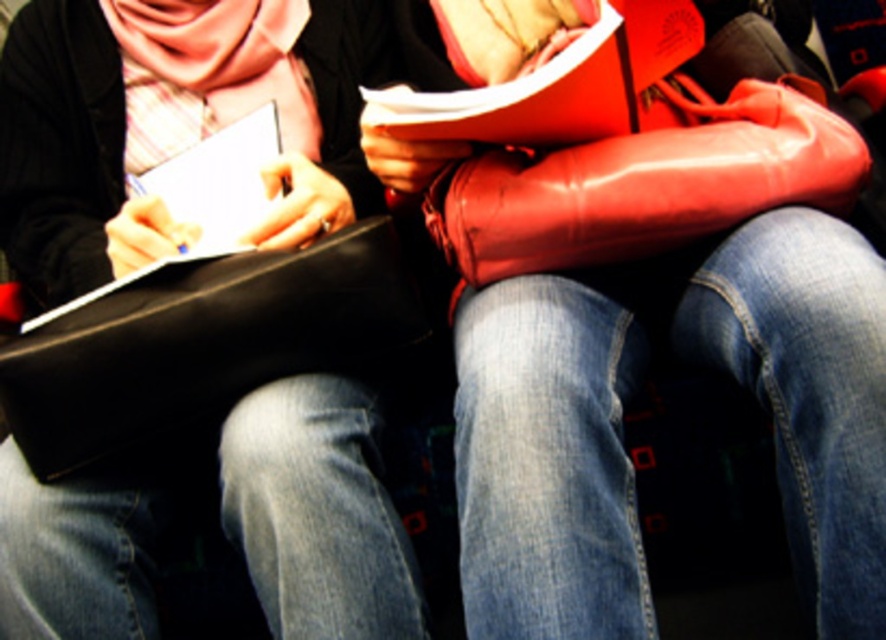
Question: Which of these objects is positioned farthest from the black leather bag at lower left?

Choices:
 (A) rubberized red bag at center
 (B) matte black bag at center
 (C) glossy leather boot at center

Answer: (C)

Question: Is rubberized red bag at center thinner than black leather bag at lower left?

Choices:
 (A) no
 (B) yes

Answer: (A)

Question: Does matte black bag at center appear under black leather bag at lower left?

Choices:
 (A) yes
 (B) no

Answer: (B)

Question: Does matte black bag at center appear under glossy leather boot at center?

Choices:
 (A) no
 (B) yes

Answer: (B)

Question: Which point appears farthest from the camera in this image?

Choices:
 (A) [812, 200]
 (B) [817, 588]

Answer: (A)

Question: Which point is closer to the camera?

Choices:
 (A) (x=382, y=340)
 (B) (x=284, y=412)

Answer: (B)